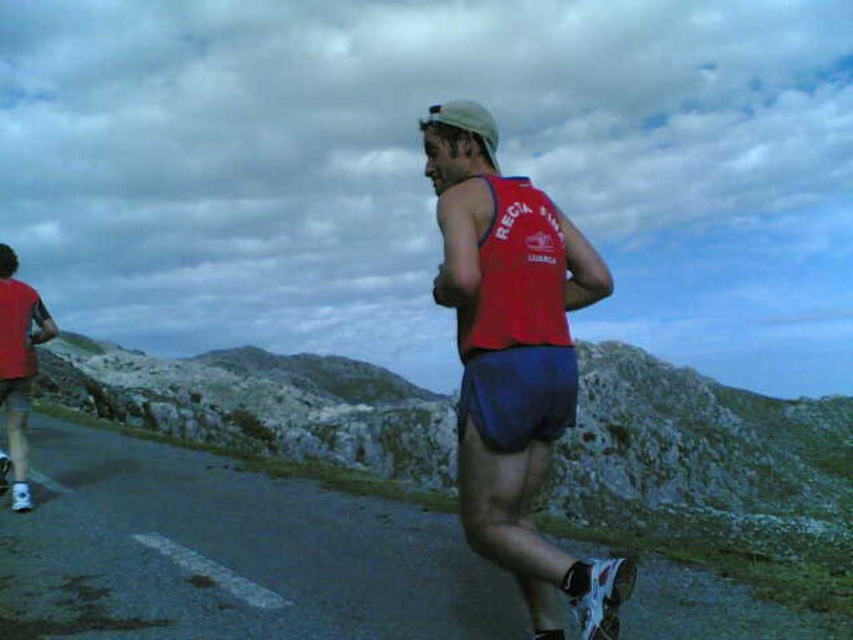
Is dark asphalt road at center shorter than matte red tank top at center?

Yes, dark asphalt road at center is shorter than matte red tank top at center.

Who is lower down, dark asphalt road at center or matte red tank top at center?

dark asphalt road at center is lower down.

Describe the element at coordinates (229, 554) in the screenshot. I see `dark asphalt road at center` at that location.

Where is `dark asphalt road at center`? The width and height of the screenshot is (853, 640). dark asphalt road at center is located at coordinates (229, 554).